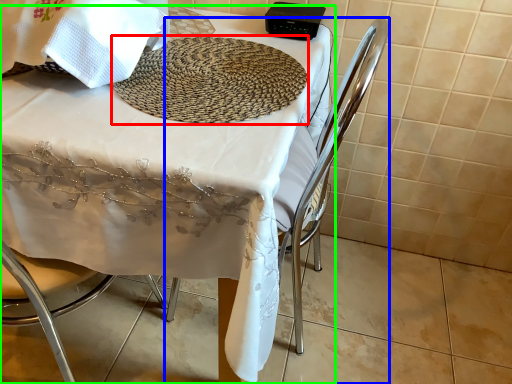
Question: Which object is the farthest from mat (highlighted by a red box)? Choose among these: chair (highlighted by a blue box) or table (highlighted by a green box).

Choices:
 (A) chair
 (B) table

Answer: (A)